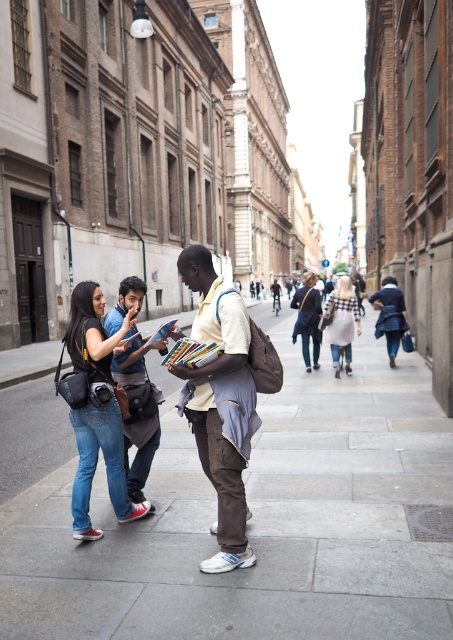
You are a photographer trying to capture a clear shot of the two central figures in the scene. The white checkered dress at center and the matte black jacket at center are both in your frame. Which of these two items should you focus on to ensure it appears larger in your photo?

The white checkered dress at center is larger in size than the matte black jacket at center, so focusing on the white checkered dress at center will ensure it appears larger in the photo.

You are a photographer trying to capture a group photo of the two people in the center wearing the white checkered dress at center and matte black jacket at center. Since you want them to be side by side in the frame, which one should you position to the left to maintain their original spatial arrangement?

To maintain their original spatial arrangement, you should position the matte black jacket at center to the left because the white checkered dress at center is currently to the right of the matte black jacket at center.

You are a photographer trying to capture a candid shot of the two people wearing the white checkered dress at center and the matte black jacket at center. What is the minimum distance you need to maintain between them to ensure both are in focus?

The white checkered dress at center and matte black jacket at center are 34.59 inches apart, so you need to maintain at least that distance between them to ensure both are in focus.